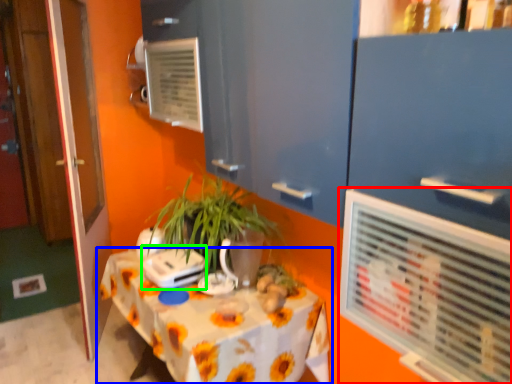
Question: Which object is the farthest from air conditioning (highlighted by a red box)? Choose among these: table (highlighted by a blue box) or appliance (highlighted by a green box).

Choices:
 (A) table
 (B) appliance

Answer: (B)